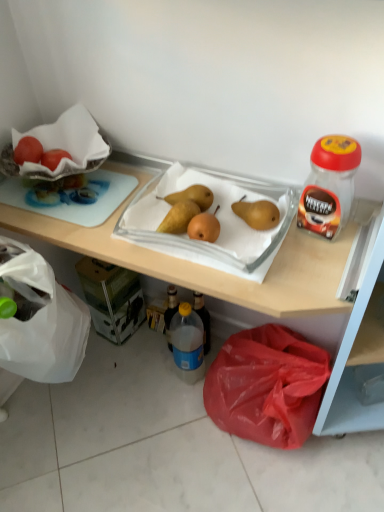
Image resolution: width=384 pixels, height=512 pixels. In order to click on free space to the left of translucent plastic bottle at lower center in this screenshot , I will do `click(138, 379)`.